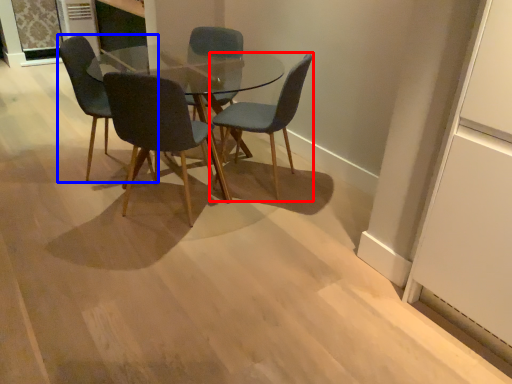
Question: Which of the following is the closest to the observer, chair (highlighted by a red box) or chair (highlighted by a blue box)?

Choices:
 (A) chair
 (B) chair

Answer: (A)